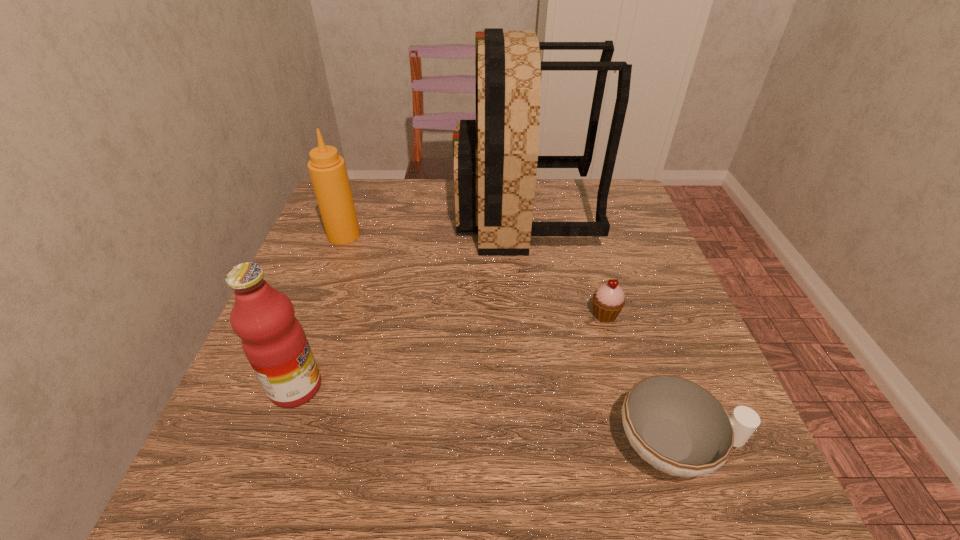
You are a GUI agent. You are given a task and a screenshot of the screen. Output one action in this format:
    pyautogui.click(x=<x>, y=<y>)
    Task: Click on the vacant area situated on the left of the third farthest object
    The width and height of the screenshot is (960, 540).
    Given the screenshot: What is the action you would take?
    pyautogui.click(x=564, y=314)

This screenshot has height=540, width=960. I want to click on backpack that is at the far edge, so click(x=495, y=158).

This screenshot has width=960, height=540. Identify the location of condiment positioned at the far edge. (327, 169).

Find the location of a particular element. Image resolution: width=960 pixels, height=540 pixels. object at the near edge is located at coordinates (677, 426).

At what (x,y) coordinates should I click in order to perform the action: click on condiment positioned at the left edge. Please return your answer as a coordinate pair (x, y). This screenshot has height=540, width=960. Looking at the image, I should click on (327, 169).

This screenshot has height=540, width=960. What are the coordinates of `fruit juice located at the left edge` in the screenshot? It's located at (274, 342).

The width and height of the screenshot is (960, 540). I want to click on backpack present at the right edge, so click(x=495, y=158).

Find the location of a particular element. cupcake located at the right edge is located at coordinates (609, 299).

Locate an element on the screen. The image size is (960, 540). chinaware at the right edge is located at coordinates (677, 426).

You are a GUI agent. You are given a task and a screenshot of the screen. Output one action in this format:
    pyautogui.click(x=<x>, y=<y>)
    Task: Click on the object present at the far left corner
    The width and height of the screenshot is (960, 540).
    Given the screenshot: What is the action you would take?
    pyautogui.click(x=327, y=169)